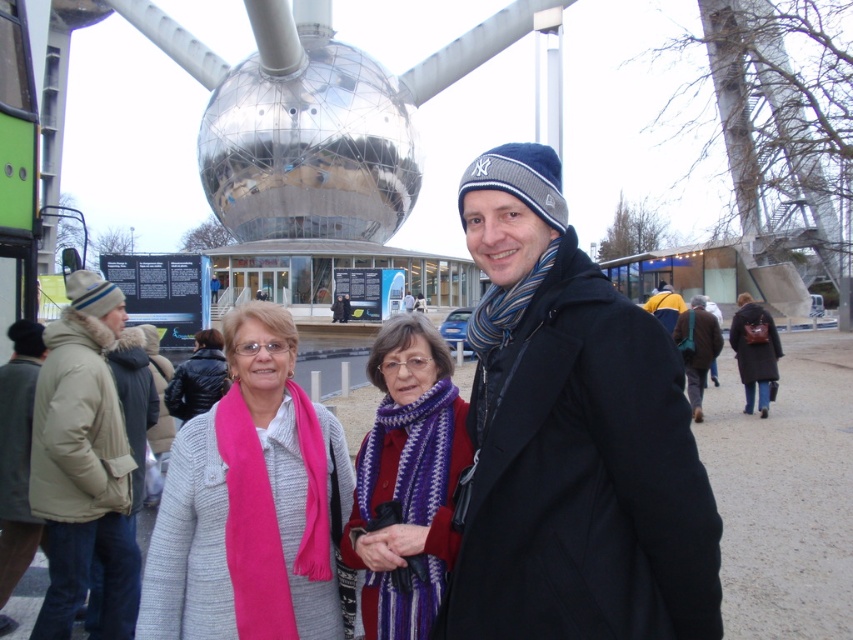
Question: Is light brown leather jacket at left bigger than yellow knit hat at center?

Choices:
 (A) yes
 (B) no

Answer: (B)

Question: Is dark blue woolen coat at center positioned at the back of brown leather jacket at center?

Choices:
 (A) yes
 (B) no

Answer: (B)

Question: Can you confirm if matte pink scarf at center is positioned above light brown leather jacket at left?

Choices:
 (A) yes
 (B) no

Answer: (A)

Question: Which point is closer to the camera?

Choices:
 (A) light brown leather jacket at left
 (B) dark blue wool coat at right
 (C) dark blue woolen coat at center
 (D) knitted scarf at center

Answer: (C)

Question: Which object is closer to the camera taking this photo?

Choices:
 (A) tan fur-lined coat at left
 (B) brown leather jacket at center
 (C) dark blue woolen coat at center
 (D) knitted scarf at center

Answer: (C)

Question: Which point is closer to the camera taking this photo?

Choices:
 (A) (671, 364)
 (B) (668, 321)
 (C) (758, 310)
 (D) (19, 403)

Answer: (A)